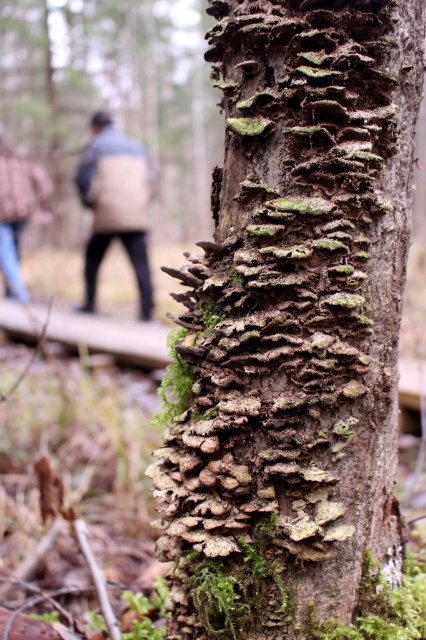
Question: Is green mossy bark at center behind beige wool coat at left?

Choices:
 (A) no
 (B) yes

Answer: (A)

Question: Which point appears farthest from the camera in this image?

Choices:
 (A) (285, 225)
 (B) (135, 221)

Answer: (B)

Question: Is beige wool coat at left thinner than blue jeans at lower left?

Choices:
 (A) no
 (B) yes

Answer: (A)

Question: Does green mossy bark at center have a greater width compared to blue jeans at lower left?

Choices:
 (A) no
 (B) yes

Answer: (A)

Question: Which point appears farthest from the camera in this image?

Choices:
 (A) (189, 456)
 (B) (32, 164)

Answer: (B)

Question: Which of the following is the farthest from the observer?

Choices:
 (A) (253, 16)
 (B) (37, 209)

Answer: (B)